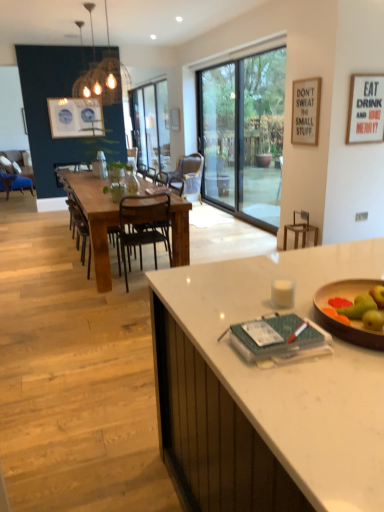
Locate an element on the screen. The height and width of the screenshot is (512, 384). vacant space positioned to the left of green matte apple at right is located at coordinates (317, 339).